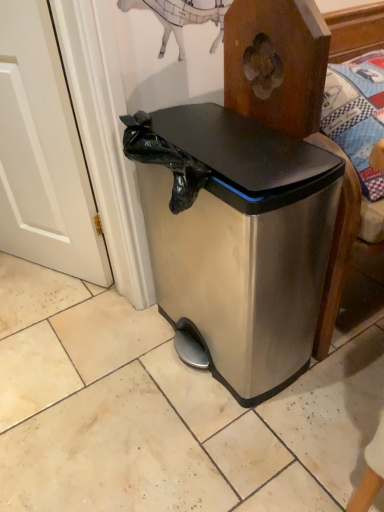
You are a GUI agent. You are given a task and a screenshot of the screen. Output one action in this format:
    pyautogui.click(x=<x>, y=<y>)
    Task: Click on the vacant space that is to the left of stainless steel trash can at center
    
    Given the screenshot: What is the action you would take?
    pyautogui.click(x=95, y=371)